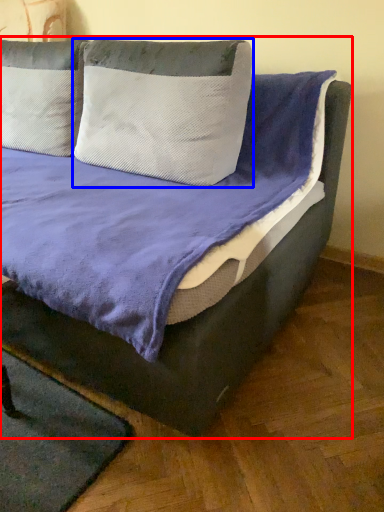
Question: Which point is further to the camera, bed (highlighted by a red box) or pillow (highlighted by a blue box)?

Choices:
 (A) bed
 (B) pillow

Answer: (B)